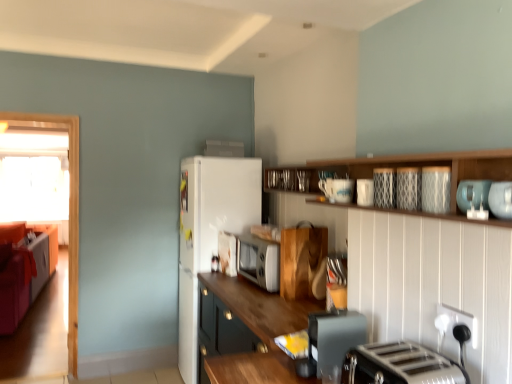
Question: From the image's perspective, is patterned ceramic plate at upper center, the 3th appliance viewed from the front, positioned above or below wooden cabinet at center, which ranks as the second cabinetry in top-to-bottom order?

Choices:
 (A) below
 (B) above

Answer: (B)

Question: Looking at the image, does patterned ceramic plate at upper center, placed as the fifth appliance when sorted from back to front, seem bigger or smaller compared to wooden cabinet at center, the 1th cabinetry positioned from the front?

Choices:
 (A) big
 (B) small

Answer: (B)

Question: Which of these objects is positioned closest to the white matte refrigerator at upper center, the 7th appliance ordered from the bottom?

Choices:
 (A) velvet orange couch at left
 (B) wooden microwave at center, acting as the 6th appliance starting from the top
 (C) patterned ceramic plate at upper center, which is the 6th appliance in bottom-to-top order
 (D) transparent glass door at left
 (E) white frosted glass window at left

Answer: (B)

Question: Estimate the real-world distances between objects in this image. Which object is farther from the patterned ceramic plate at upper center, the 3th appliance viewed from the front?

Choices:
 (A) wooden cabinet at center, which ranks as the second cabinetry in top-to-bottom order
 (B) white glossy microwave at center, arranged as the 6th appliance when viewed from the front
 (C) transparent glass door at left
 (D) metallic gray toaster at lower center, acting as the seventh appliance starting from the top
 (E) silver metallic toaster at lower right

Answer: (C)